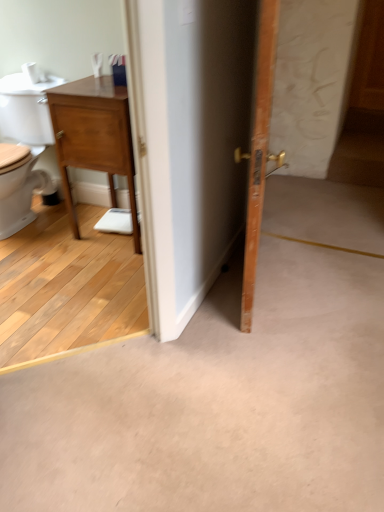
Question: Does point (253, 205) appear closer or farther from the camera than point (59, 119)?

Choices:
 (A) closer
 (B) farther

Answer: (A)

Question: Is wooden door at right spatially inside wooden nightstand at left, or outside of it?

Choices:
 (A) inside
 (B) outside

Answer: (B)

Question: Looking at their shapes, would you say wooden door at right is wider or thinner than wooden nightstand at left?

Choices:
 (A) thin
 (B) wide

Answer: (A)

Question: Is wooden nightstand at left inside or outside of wooden door at right?

Choices:
 (A) outside
 (B) inside

Answer: (A)

Question: From their relative heights in the image, would you say wooden nightstand at left is taller or shorter than wooden door at right?

Choices:
 (A) tall
 (B) short

Answer: (B)

Question: Looking at the image, does wooden nightstand at left seem bigger or smaller compared to wooden door at right?

Choices:
 (A) big
 (B) small

Answer: (A)

Question: From the image's perspective, is wooden nightstand at left located above or below wooden door at right?

Choices:
 (A) below
 (B) above

Answer: (B)